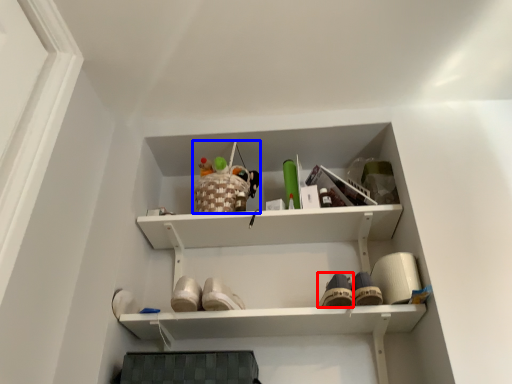
Question: Among these objects, which one is nearest to the camera, shoe (highlighted by a red box) or toy (highlighted by a blue box)?

Choices:
 (A) shoe
 (B) toy

Answer: (A)